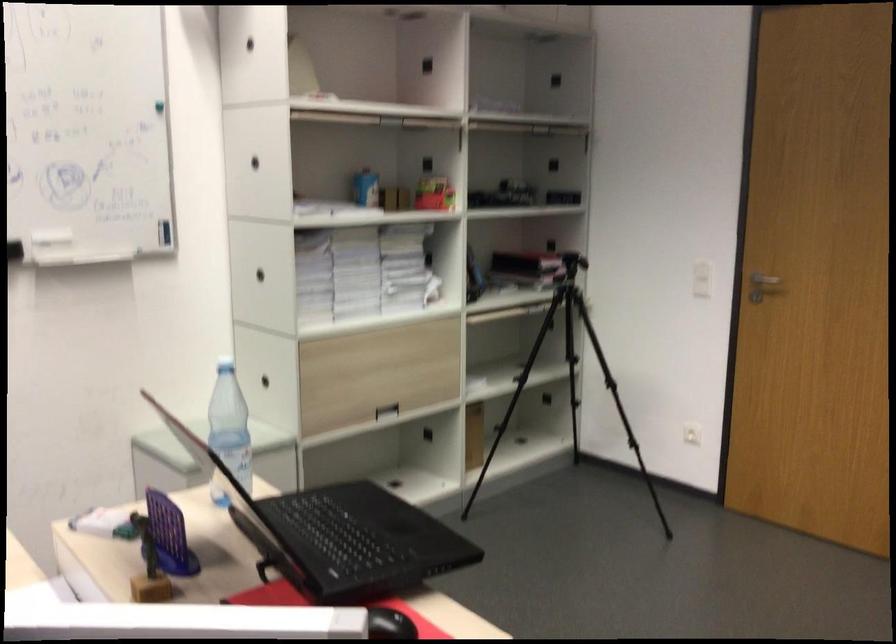
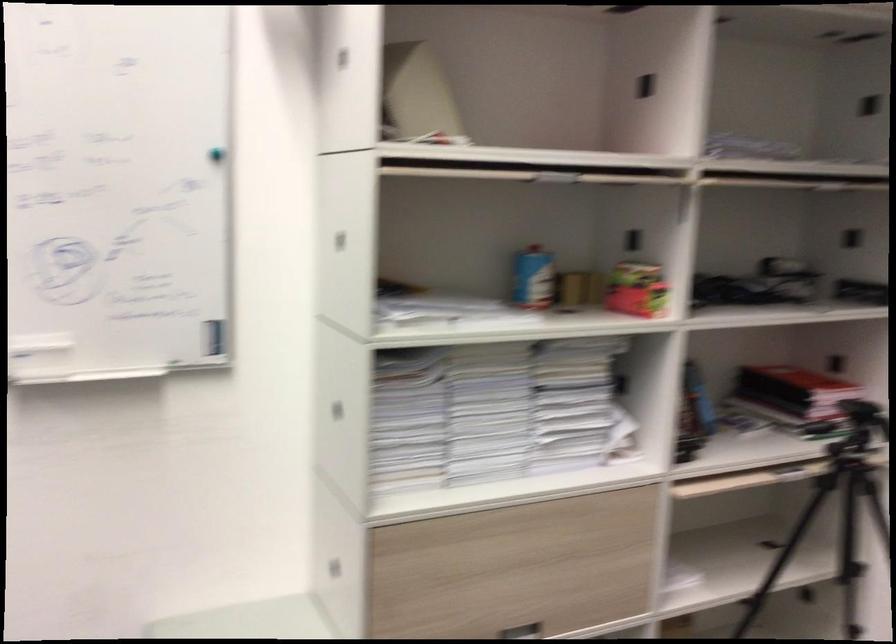
In the second image, find the point that corresponds to (x=563, y=77) in the first image.

(869, 104)